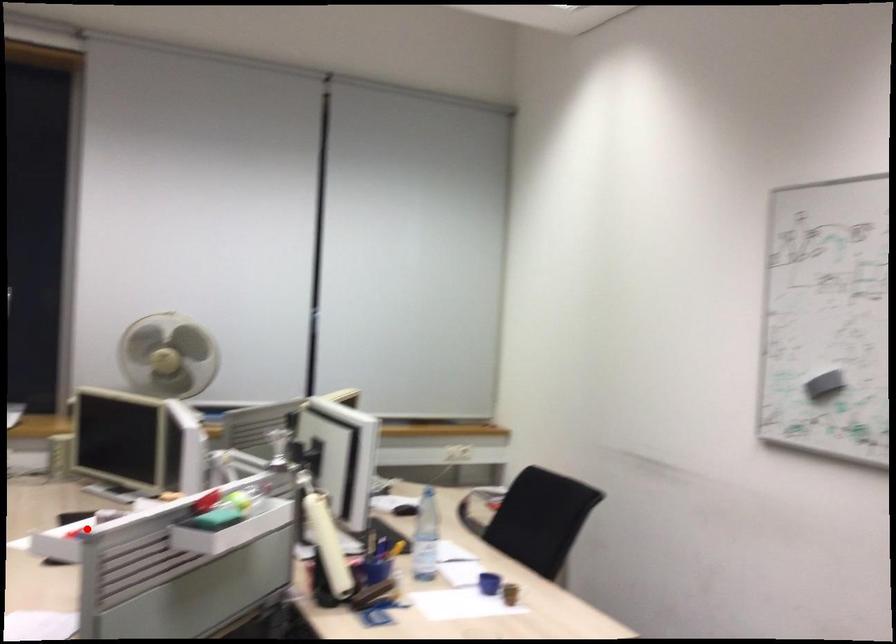
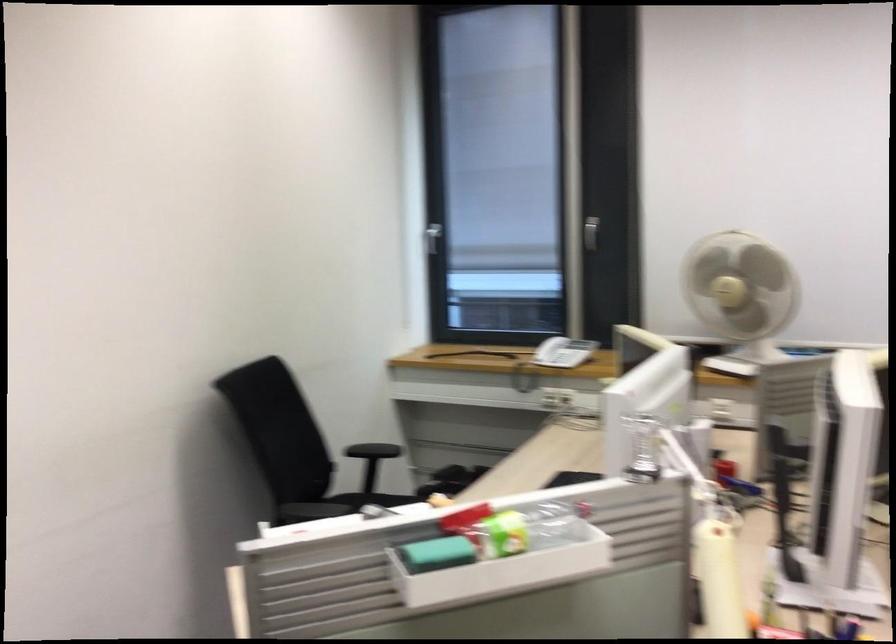
Question: I am providing you with two images of the same scene from different viewpoints. Image1 has a red point marked. In image2, the corresponding 3D location appears at what relative position? Reply with the corresponding letter.

Choices:
 (A) Closer
 (B) Farther

Answer: (A)